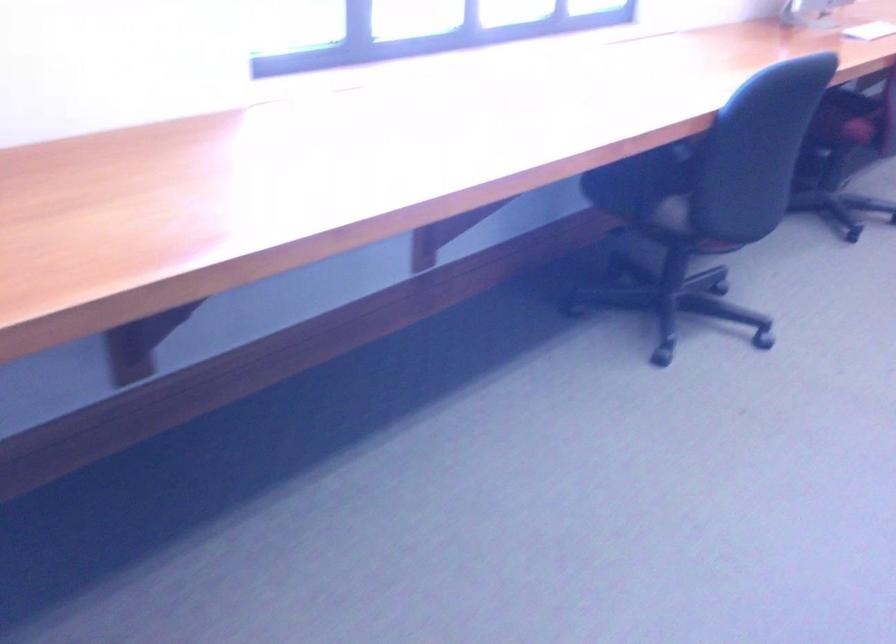
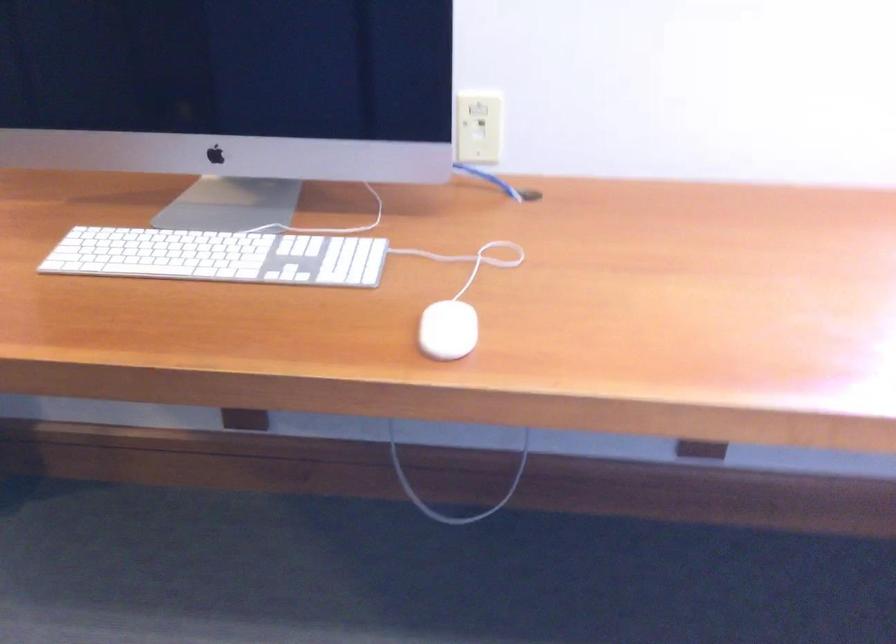
Question: The camera is either moving clockwise (left) or counter-clockwise (right) around the object. The first image is from the beginning of the video and the second image is from the end. Is the camera moving left or right when shooting the video?

Choices:
 (A) Left
 (B) Right

Answer: (B)